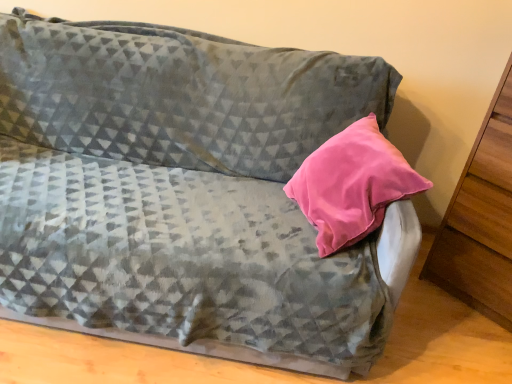
Image resolution: width=512 pixels, height=384 pixels. What do you see at coordinates (481, 219) in the screenshot?
I see `wooden dresser at right` at bounding box center [481, 219].

The width and height of the screenshot is (512, 384). What are the coordinates of `wooden dresser at right` in the screenshot? It's located at (481, 219).

Where is `wooden dresser at right`? The image size is (512, 384). wooden dresser at right is located at coordinates [481, 219].